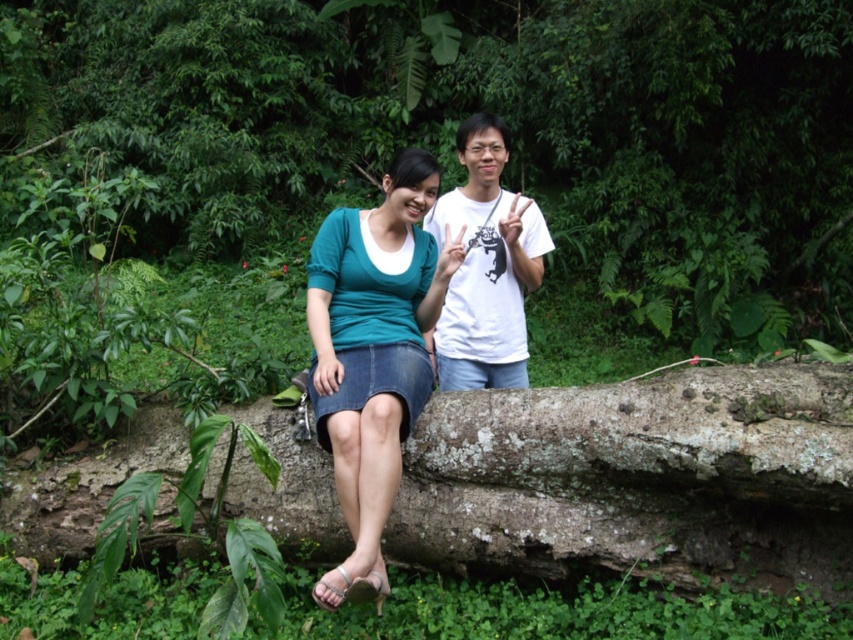
Is rough bark log at center thinner than white matte t-shirt at center?

In fact, rough bark log at center might be wider than white matte t-shirt at center.

The image size is (853, 640). Describe the element at coordinates (639, 480) in the screenshot. I see `rough bark log at center` at that location.

Where is `rough bark log at center`? This screenshot has height=640, width=853. rough bark log at center is located at coordinates (639, 480).

Can you confirm if denim skirt at center is thinner than white matte t-shirt at center?

No, denim skirt at center is not thinner than white matte t-shirt at center.

Which is more to the left, denim skirt at center or white matte t-shirt at center?

From the viewer's perspective, denim skirt at center appears more on the left side.

This screenshot has width=853, height=640. Describe the element at coordinates (373, 353) in the screenshot. I see `denim skirt at center` at that location.

This screenshot has width=853, height=640. I want to click on denim skirt at center, so click(373, 353).

Which is in front, point (496, 547) or point (378, 291)?

Positioned in front is point (496, 547).

Between rough bark log at center and denim skirt at center, which one has more height?

Standing taller between the two is denim skirt at center.

Locate an element on the screen. rough bark log at center is located at coordinates (639, 480).

You are a GUI agent. You are given a task and a screenshot of the screen. Output one action in this format:
    pyautogui.click(x=<x>, y=<y>)
    Task: Click on the rough bark log at center
    The height and width of the screenshot is (640, 853).
    Given the screenshot: What is the action you would take?
    pyautogui.click(x=639, y=480)